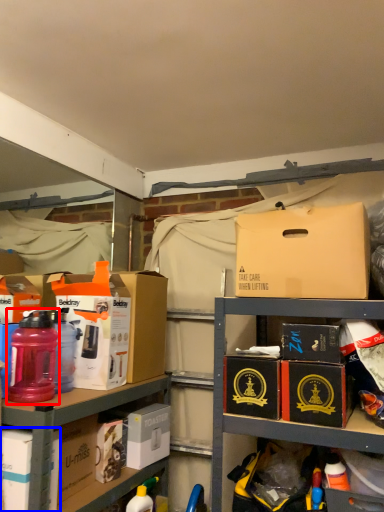
Question: Which object is further to the camera taking this photo, bottle (highlighted by a red box) or box (highlighted by a blue box)?

Choices:
 (A) bottle
 (B) box

Answer: (A)